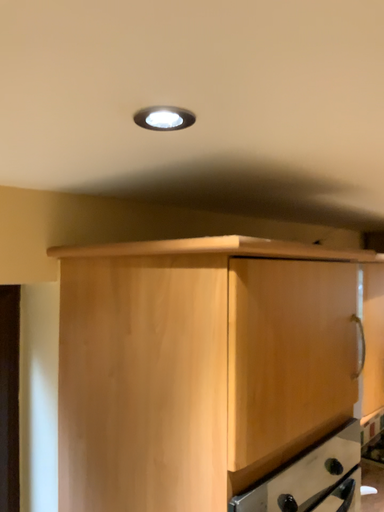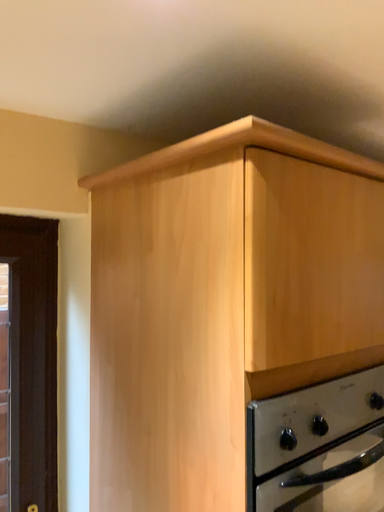
Question: How did the camera likely rotate when shooting the video?

Choices:
 (A) rotated left
 (B) rotated right

Answer: (A)